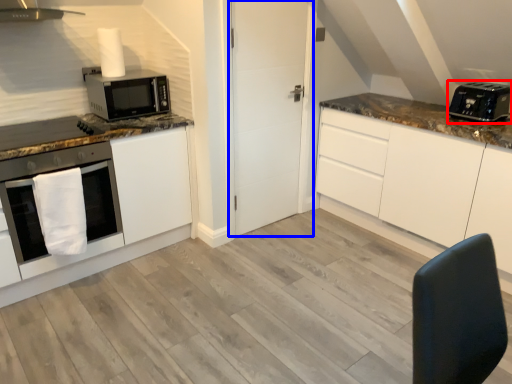
Question: Which point is closer to the camera, toaster (highlighted by a red box) or door (highlighted by a blue box)?

Choices:
 (A) toaster
 (B) door

Answer: (A)